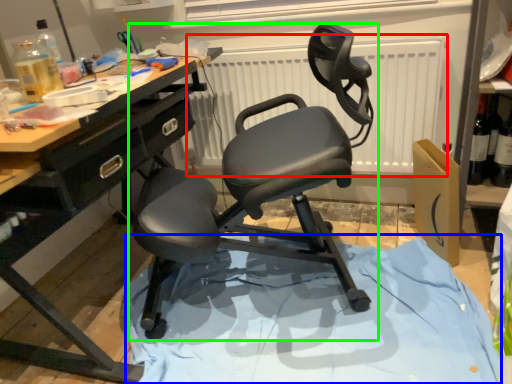
Question: Estimate the real-world distances between objects in this image. Which object is closer to radiator (highlighted by a red box), fabric (highlighted by a blue box) or chair (highlighted by a green box)?

Choices:
 (A) fabric
 (B) chair

Answer: (B)